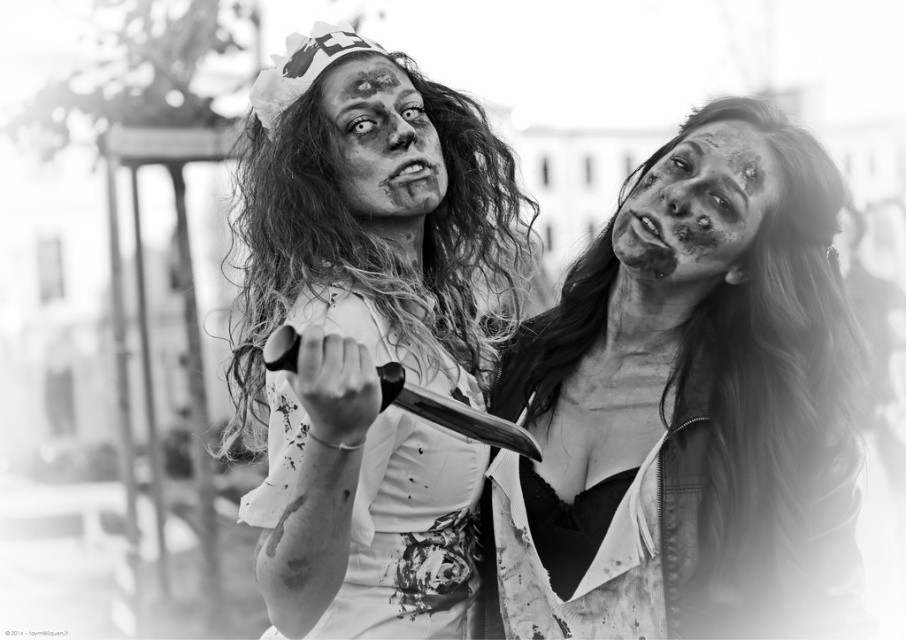
Is point (586, 392) positioned behind point (451, 538)?

No, it is not.

What do you see at coordinates (688, 406) in the screenshot? I see `matte white jacket at center` at bounding box center [688, 406].

The width and height of the screenshot is (906, 640). What are the coordinates of `matte white jacket at center` in the screenshot? It's located at (688, 406).

Does matte white jacket at center come behind matte skin face at right?

No, matte white jacket at center is closer to the viewer.

Is matte white jacket at center thinner than matte skin face at right?

In fact, matte white jacket at center might be wider than matte skin face at right.

Does point (717, 333) come in front of point (712, 138)?

No, it is not.

At what (x,y) coordinates should I click in order to perform the action: click on matte white jacket at center. Please return your answer as a coordinate pair (x, y). The width and height of the screenshot is (906, 640). Looking at the image, I should click on (688, 406).

From the picture: Does matte white dress at center have a greater height compared to matte white face at center?

Indeed, matte white dress at center has a greater height compared to matte white face at center.

At what (x,y) coordinates should I click in order to perform the action: click on matte white dress at center. Please return your answer as a coordinate pair (x, y). Looking at the image, I should click on (369, 333).